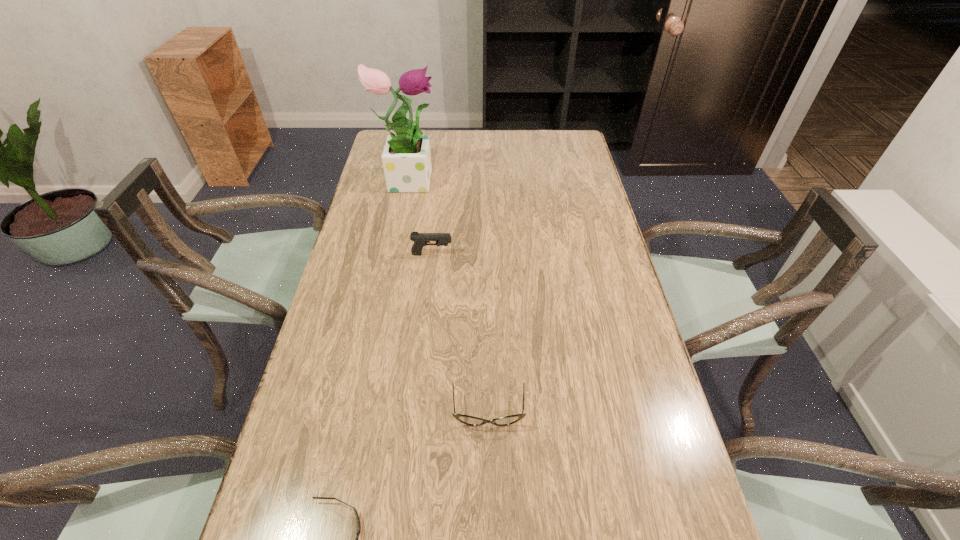
This screenshot has width=960, height=540. I want to click on the tallest object, so click(x=406, y=158).

Where is `the farthest object`? This screenshot has width=960, height=540. the farthest object is located at coordinates (406, 158).

The width and height of the screenshot is (960, 540). I want to click on pistol, so click(420, 239).

Image resolution: width=960 pixels, height=540 pixels. I want to click on the second tallest object, so click(x=420, y=239).

Find the location of a particular element. Image resolution: width=960 pixels, height=540 pixels. the second shortest object is located at coordinates (465, 419).

Locate an element on the screen. The image size is (960, 540). the third farthest object is located at coordinates (465, 419).

Where is `vacant space located on the front-facing side of the tallest object`? Image resolution: width=960 pixels, height=540 pixels. vacant space located on the front-facing side of the tallest object is located at coordinates (516, 179).

Locate an element on the screen. vacant area located at the barrel of the pistol is located at coordinates (575, 254).

This screenshot has width=960, height=540. What are the coordinates of `vacant region located on the front-facing side of the third tallest object` in the screenshot? It's located at (490, 463).

This screenshot has height=540, width=960. Identify the location of object located at the left edge. (406, 158).